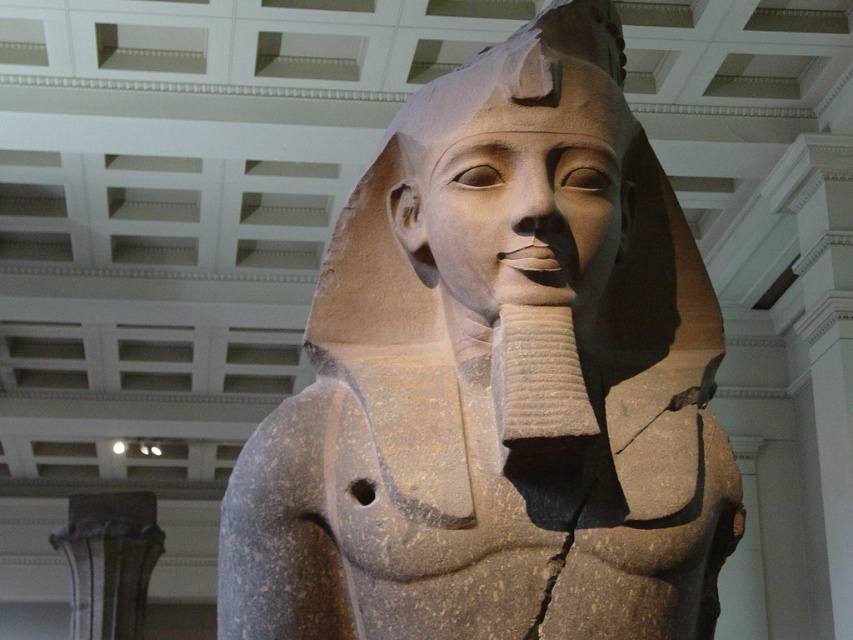
Question: Which point appears farthest from the camera in this image?

Choices:
 (A) (511, 61)
 (B) (433, 570)

Answer: (A)

Question: Which point is closer to the camera taking this photo?

Choices:
 (A) (415, 120)
 (B) (450, 312)

Answer: (B)

Question: Is gray stone statue at center bigger than smooth stone head at center?

Choices:
 (A) no
 (B) yes

Answer: (B)

Question: Is gray stone statue at center smaller than smooth stone head at center?

Choices:
 (A) yes
 (B) no

Answer: (B)

Question: Can you confirm if gray stone statue at center is positioned below smooth stone head at center?

Choices:
 (A) yes
 (B) no

Answer: (A)